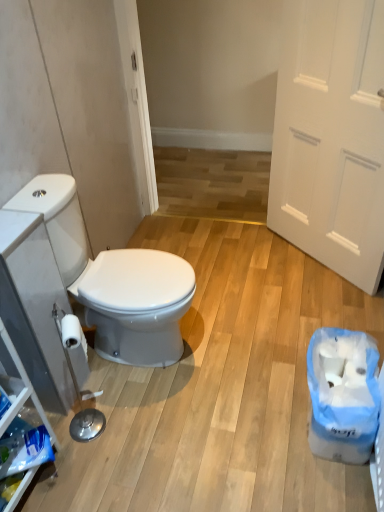
The height and width of the screenshot is (512, 384). I want to click on vacant space that is in between white glossy toilet seat at left and white matte door at right, so (262, 300).